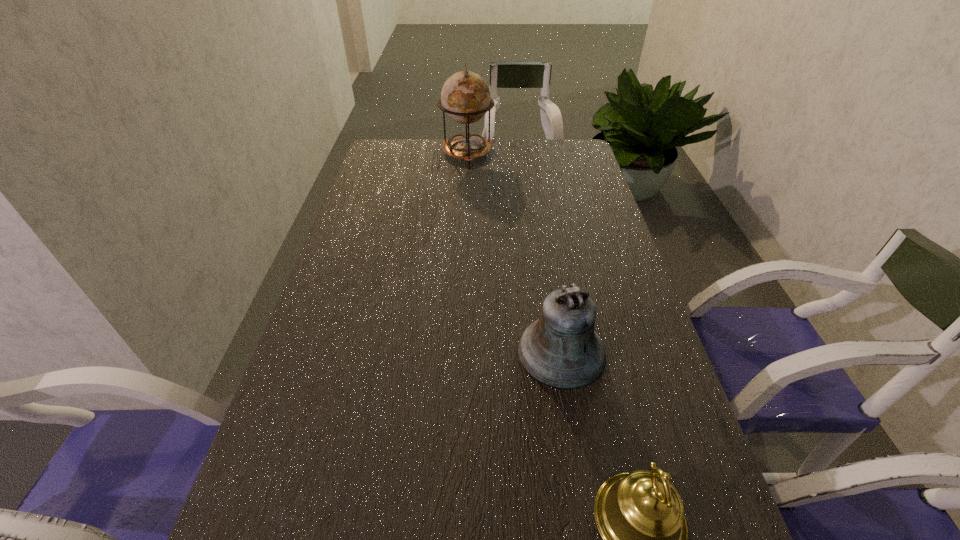
Image resolution: width=960 pixels, height=540 pixels. In order to click on the tallest object in this screenshot , I will do `click(465, 97)`.

This screenshot has width=960, height=540. Identify the location of the farthest object. (465, 97).

Find the location of a particular element. The height and width of the screenshot is (540, 960). the second nearest object is located at coordinates (561, 349).

Find the location of `free spot located at the center of the leftmost object`. free spot located at the center of the leftmost object is located at coordinates (464, 227).

Identify the location of free space located 0.270m on the front of the second nearest object. The image size is (960, 540). (591, 530).

The height and width of the screenshot is (540, 960). What are the coordinates of `object present at the far edge` in the screenshot? It's located at coord(465,97).

Image resolution: width=960 pixels, height=540 pixels. What are the coordinates of `object that is at the right edge` in the screenshot? It's located at (561, 349).

Find the location of a particular element. The height and width of the screenshot is (540, 960). free space at the left edge is located at coordinates point(375,251).

Image resolution: width=960 pixels, height=540 pixels. I want to click on vacant space at the right edge of the desktop, so click(x=613, y=224).

The width and height of the screenshot is (960, 540). What are the coordinates of `free space at the far left corner of the desktop` in the screenshot? It's located at (415, 151).